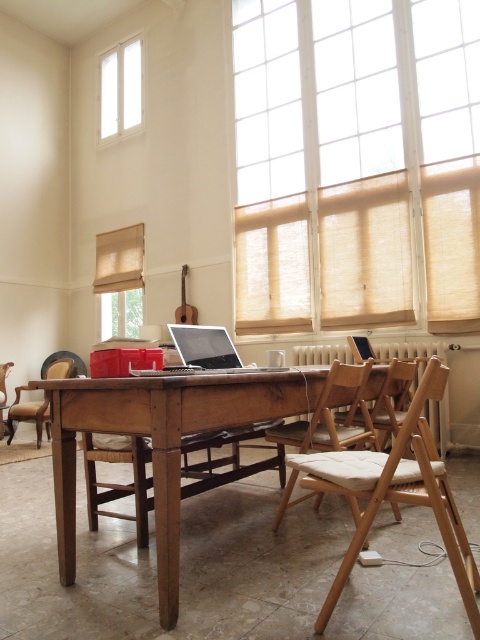
Can you confirm if wooden table at center is smaller than white glass window at upper left?

No.

What do you see at coordinates (160, 442) in the screenshot? This screenshot has height=640, width=480. I see `wooden table at center` at bounding box center [160, 442].

Locate an element on the screen. wooden table at center is located at coordinates (160, 442).

Is brown wooden armchair at left below wooden armchair at lower left?

No.

Is brown wooden armchair at left smaller than wooden armchair at lower left?

No, brown wooden armchair at left is not smaller than wooden armchair at lower left.

Is point (11, 412) farther from viewer compared to point (0, 394)?

Yes, point (11, 412) is behind point (0, 394).

I want to click on brown wooden armchair at left, so click(28, 413).

Is point (271, 364) farther from viewer compared to point (36, 417)?

No, (271, 364) is in front of (36, 417).

Is satin silver laptop at center smaller than brown wooden armchair at left?

Yes, satin silver laptop at center is smaller than brown wooden armchair at left.

Is point (273, 360) closer to camera compared to point (36, 413)?

That is True.

Identify the location of satin silver laptop at center. (204, 346).